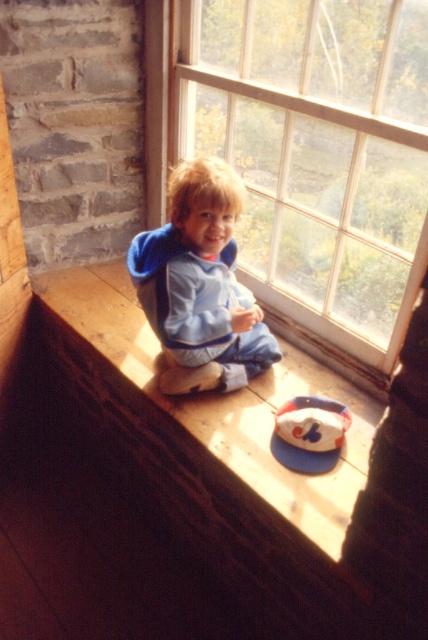
You are a parent trying to ensure your child stays safe while playing indoors. The child is sitting on the wooden at lower center near the transparent glass window at upper center. Which object should you be more cautious about to prevent injury?

You should be more cautious about the transparent glass window at upper center because it is above the wooden at lower center where the child is sitting, posing a potential risk if the child reaches up or moves towards it.

You are a visitor in the room and want to place a small plant on the wooden at lower center. However, there is a blue fleece jacket at center currently on top of it. Can you place the plant there without moving the jacket?

The wooden at lower center is positioned under the blue fleece jacket at center, so the jacket is currently occupying the surface of the wooden object. To place the plant there, you would need to first move the blue fleece jacket at center from the wooden at lower center.

You are a window cleaner who needs to clean the transparent glass window at upper center. The window is at coordinates point 0.237, 0.738. If you start from the bottom left corner of the room, which direction should you move first to reach the window?

The transparent glass window at upper center is located at point (315, 150), so you should move upwards and to the right from the bottom left corner to reach it.